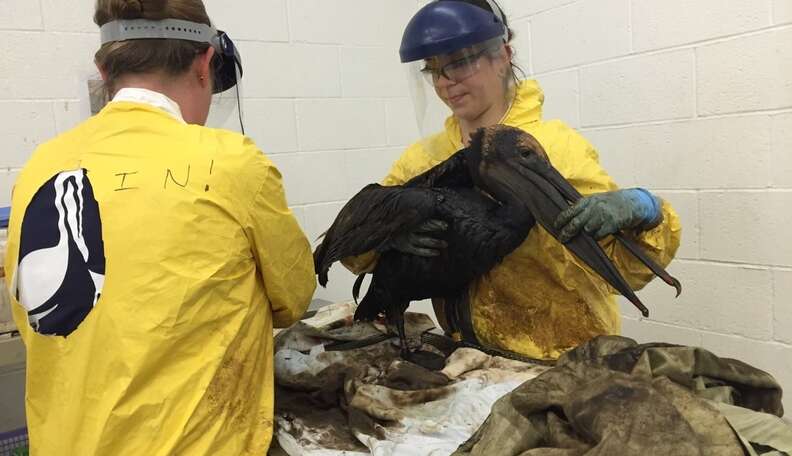
The width and height of the screenshot is (792, 456). Find the location of `dirty cloth`. dirty cloth is located at coordinates (557, 407), (390, 393).